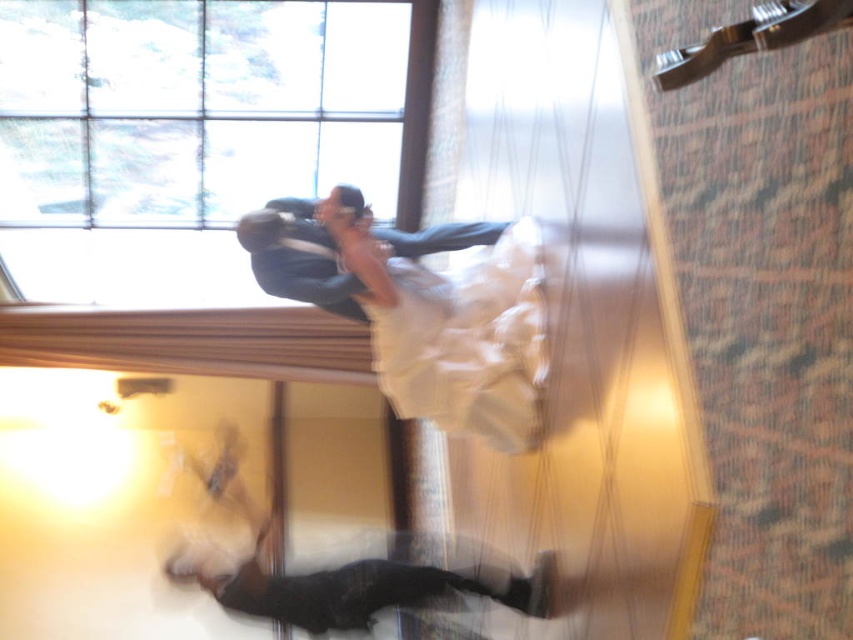
Is point (532, 353) farther from camera compared to point (341, 285)?

No, (532, 353) is closer to viewer.

Who is more distant from viewer, [442,384] or [338,266]?

The point [338,266] is more distant.

The height and width of the screenshot is (640, 853). Find the location of `white satin dress at center`. white satin dress at center is located at coordinates (467, 340).